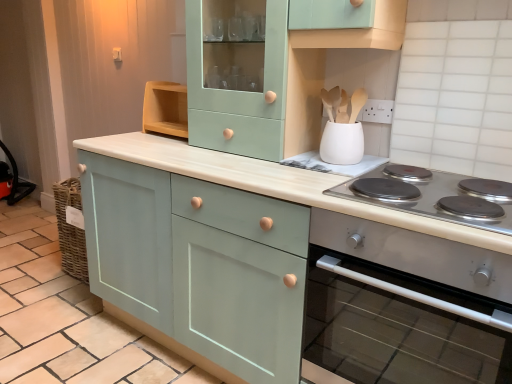
Locate an element on the screen. vacant space positioned to the left of white matte utensil holder at upper center is located at coordinates (293, 167).